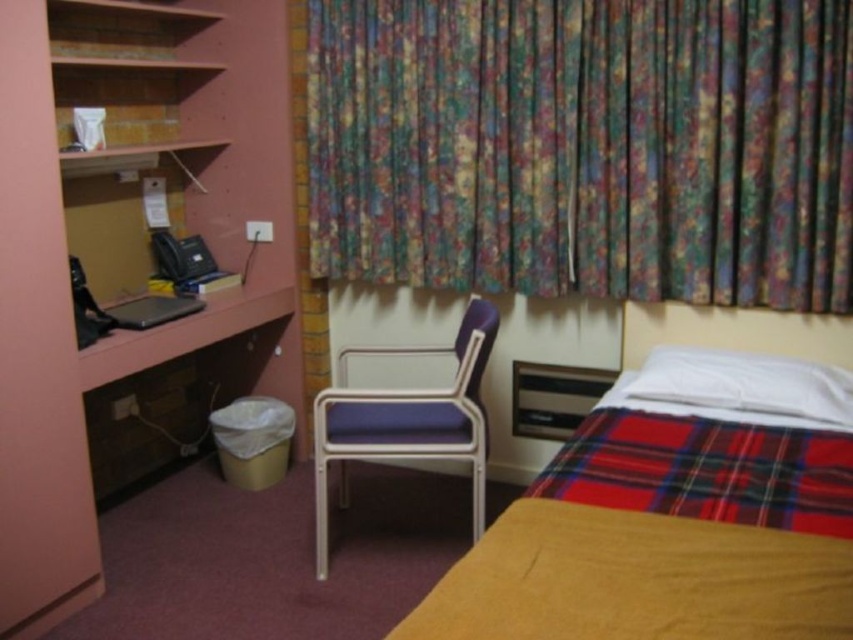
You are standing in the room and want to know where the point with coordinates (585,147) is located. According to the scene description, what object is this point located on?

The point is located on the floral fabric curtain at upper center.

You are sitting in the purple fabric chair at center and want to reach the floral fabric curtain at upper center. Which direction should you move to get closer to the curtain?

You should move forward because the floral fabric curtain at upper center is closer to you than the purple fabric chair at center, so moving forward would bring you closer to the curtain.

You are standing in the room and want to locate the floral fabric curtain at upper center. According to the coordinates provided, where exactly should you look?

The floral fabric curtain at upper center is located at coordinates point (585, 147).